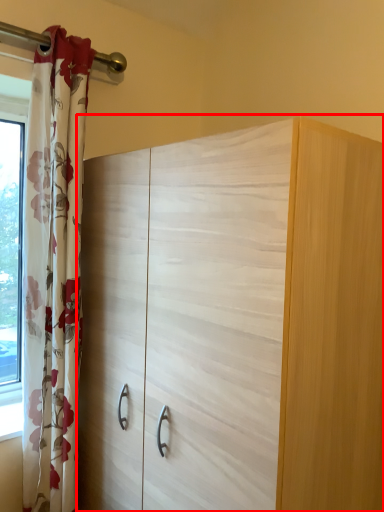
Question: From the image's perspective, where is cupboard (annotated by the red box) located relative to curtain?

Choices:
 (A) above
 (B) below

Answer: (B)